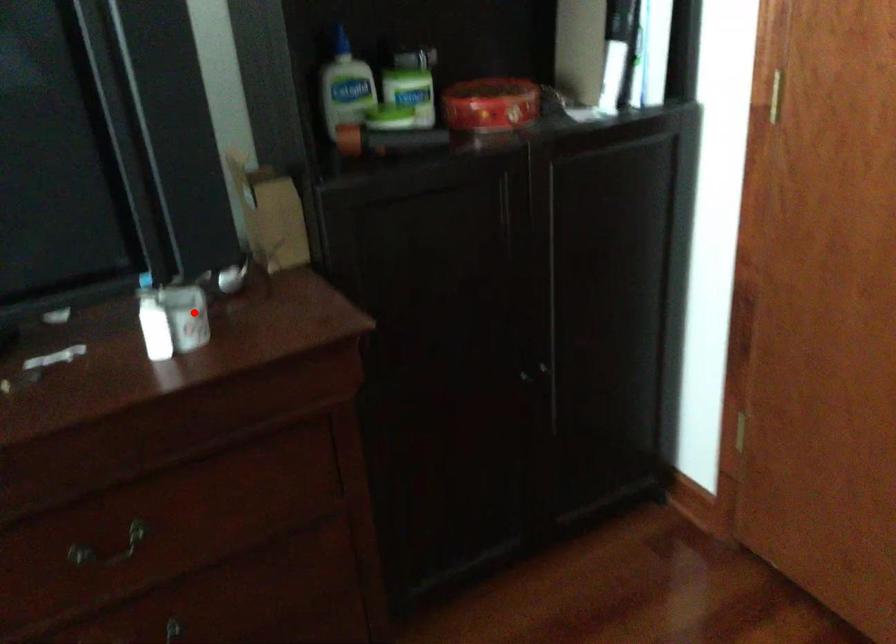
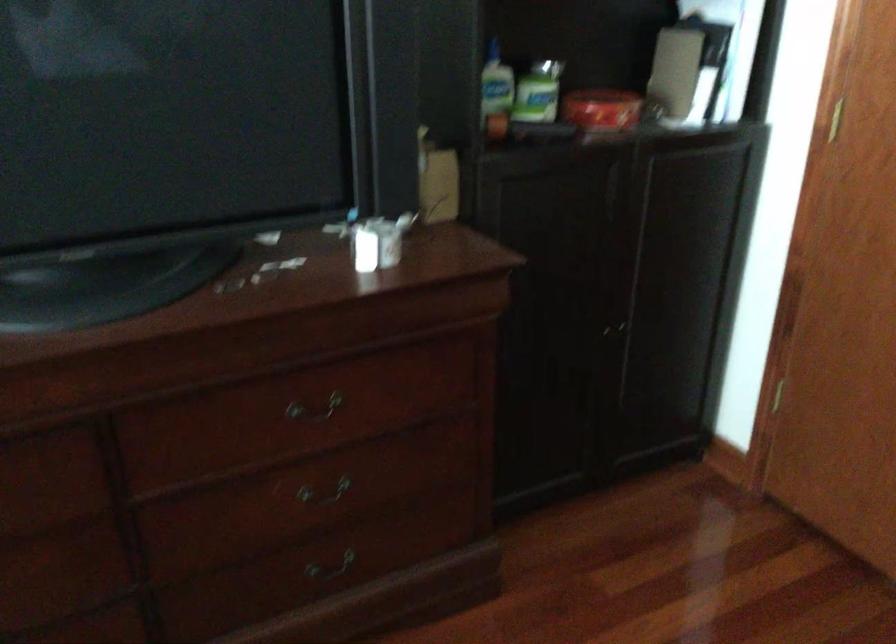
Question: I am providing you with two images of the same scene from different viewpoints. In image1, a red point is highlighted. Considering the same 3D point in image2, which of the following is correct?

Choices:
 (A) It is closer
 (B) It is farther

Answer: (B)